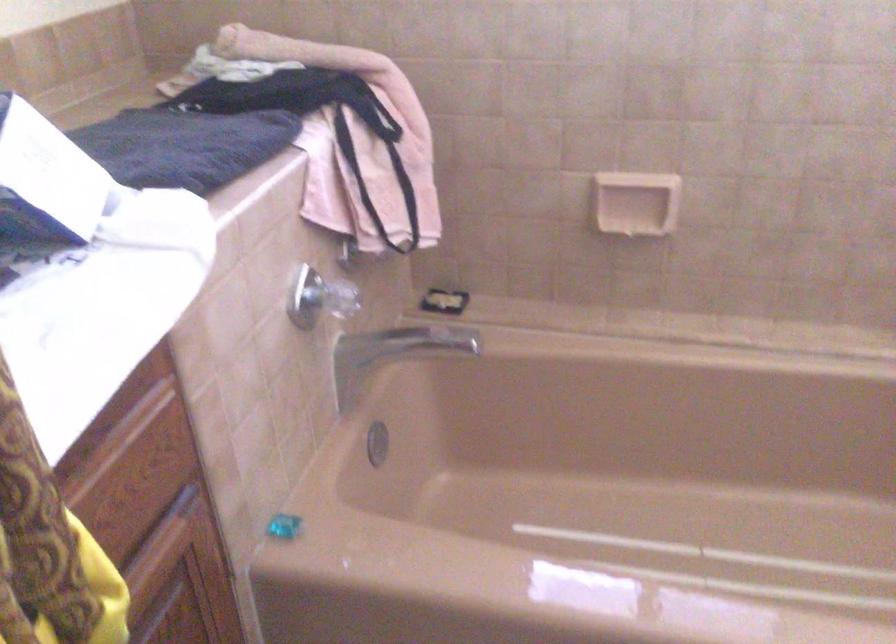
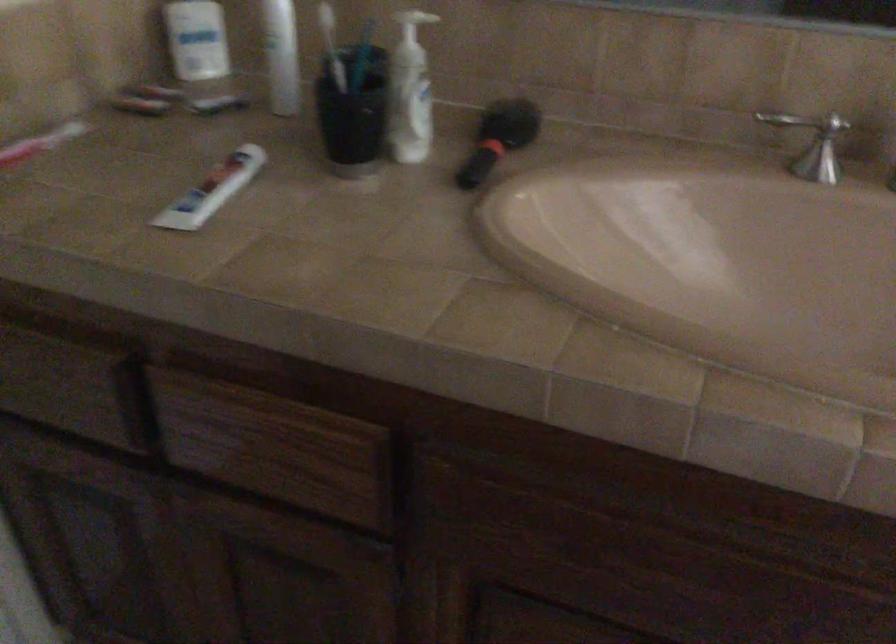
The images are taken continuously from a first-person perspective. In which direction is your viewpoint rotating?

The camera's rotation is toward left-down.